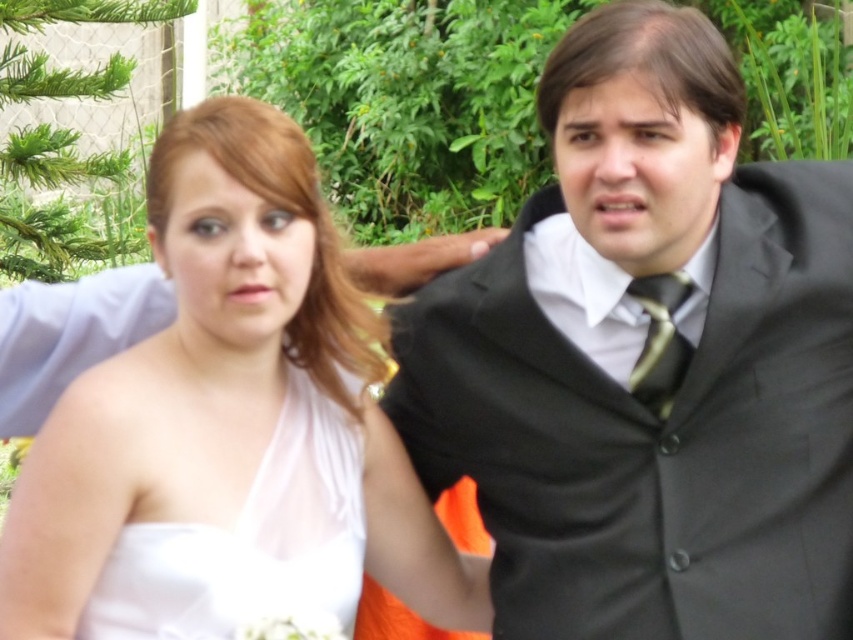
Question: Among these objects, which one is farthest from the camera?

Choices:
 (A) black satin suit at center
 (B) white satin dress at center

Answer: (B)

Question: Is black satin suit at center below green striped tie at center?

Choices:
 (A) yes
 (B) no

Answer: (A)

Question: Does black satin suit at center come in front of white satin dress at left?

Choices:
 (A) no
 (B) yes

Answer: (B)

Question: Which of the following is the farthest from the observer?

Choices:
 (A) green striped tie at center
 (B) black satin suit at center

Answer: (A)

Question: Does black satin suit at center appear over white satin dress at left?

Choices:
 (A) yes
 (B) no

Answer: (A)

Question: Estimate the real-world distances between objects in this image. Which object is closer to the white satin dress at center?

Choices:
 (A) black satin suit at center
 (B) white satin dress at left
 (C) green striped tie at center

Answer: (B)